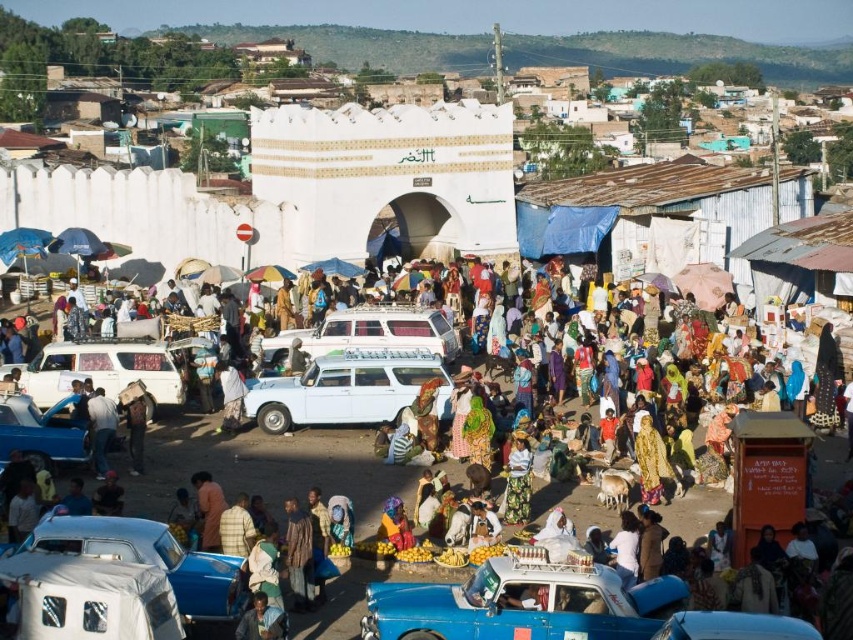
Is white covered car at lower left thinner than floral skirt at center?

In fact, white covered car at lower left might be wider than floral skirt at center.

Does point (236, 588) come farther from viewer compared to point (527, 484)?

No.

The width and height of the screenshot is (853, 640). What do you see at coordinates (148, 557) in the screenshot?
I see `white covered car at lower left` at bounding box center [148, 557].

You are a GUI agent. You are given a task and a screenshot of the screen. Output one action in this format:
    pyautogui.click(x=<x>, y=<y>)
    Task: Click on the white covered car at lower left
    The height and width of the screenshot is (640, 853).
    Given the screenshot: What is the action you would take?
    pyautogui.click(x=148, y=557)

Between point (287, 454) and point (408, 618), which one is positioned in front?

Point (408, 618) is in front.

Is white fabric umbrella at center below blue metallic car at lower center?

No.

Is point (316, 611) less distant than point (432, 625)?

No, (316, 611) is further to viewer.

Image resolution: width=853 pixels, height=640 pixels. Identify the location of white fabric umbrella at center. 264,467.

Consider the image. Does floral skirt at center have a larger size compared to dark brown leather jacket at center?

Incorrect, floral skirt at center is not larger than dark brown leather jacket at center.

Can you confirm if floral skirt at center is shorter than dark brown leather jacket at center?

Yes.

Who is more distant from viewer, (527,515) or (136,417)?

The point (136,417) is behind.

Find the location of a particular element. This screenshot has width=853, height=640. floral skirt at center is located at coordinates (517, 483).